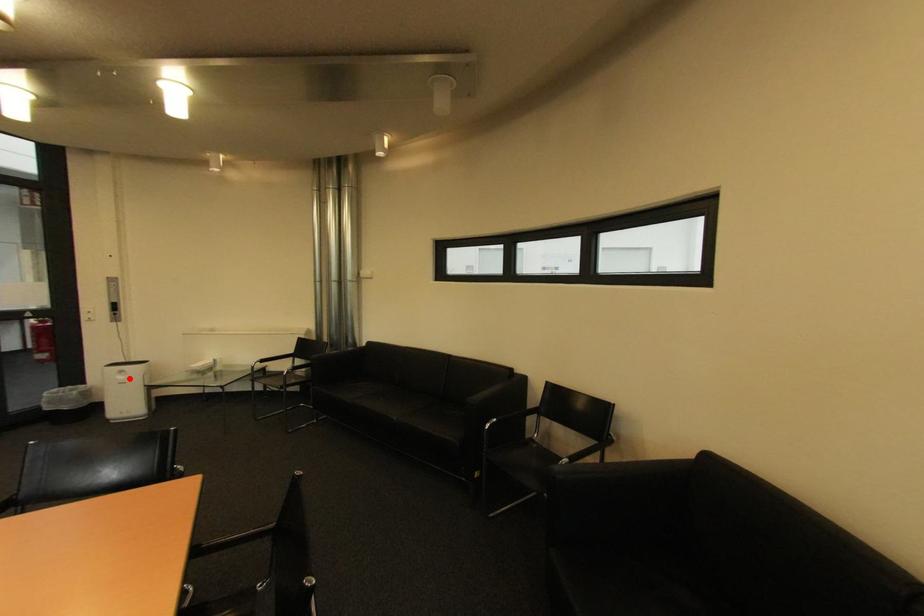
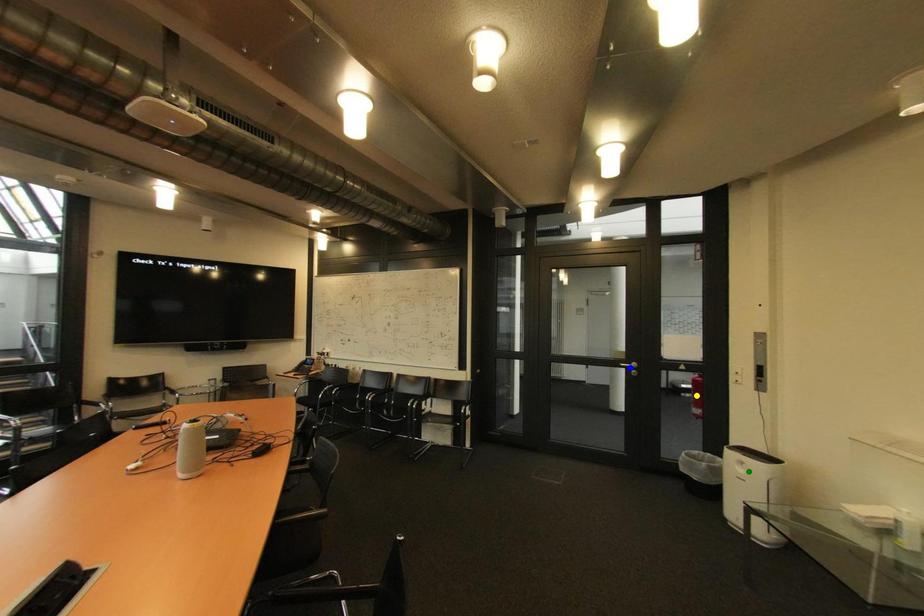
Question: I am providing you with two images of the same scene from different viewpoints. A red point is marked on the first image. You are given multiple points on the second image. In image 2, which mark is for the same physical point as the one in image 1?

Choices:
 (A) green point
 (B) blue point
 (C) yellow point

Answer: (A)